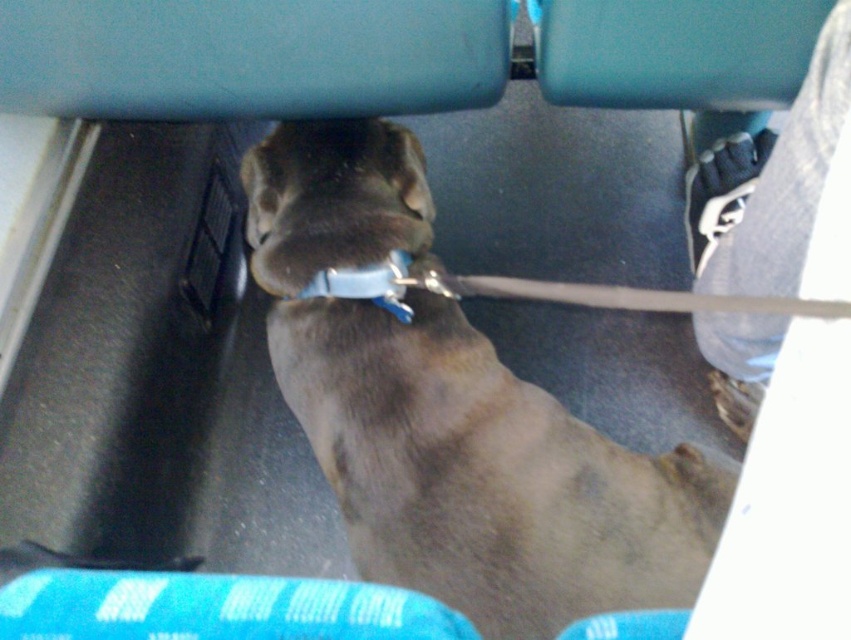
You are a passenger on a train and see the brown fur dog at center and the blue fabric neckband at center. Which object is taller?

The brown fur dog at center is much taller than the blue fabric neckband at center.

You are standing at point A and want to reach point B in a vehicle. The dog is between the two seats. If point A is at coordinates point (418,241) and point B is at coordinates point (374,298), which direction should you move to go from point A to point B?

To go from point A at coordinates point (418,241) to point B at coordinates point (374,298), you should move forward because point A is behind point B according to their coordinates.

You are a passenger on a bus and see the brown fur dog at center and the brown fur nose at center. Which one is closer to the floor?

The brown fur dog at center is closer to the floor because it is located below the brown fur nose at center.